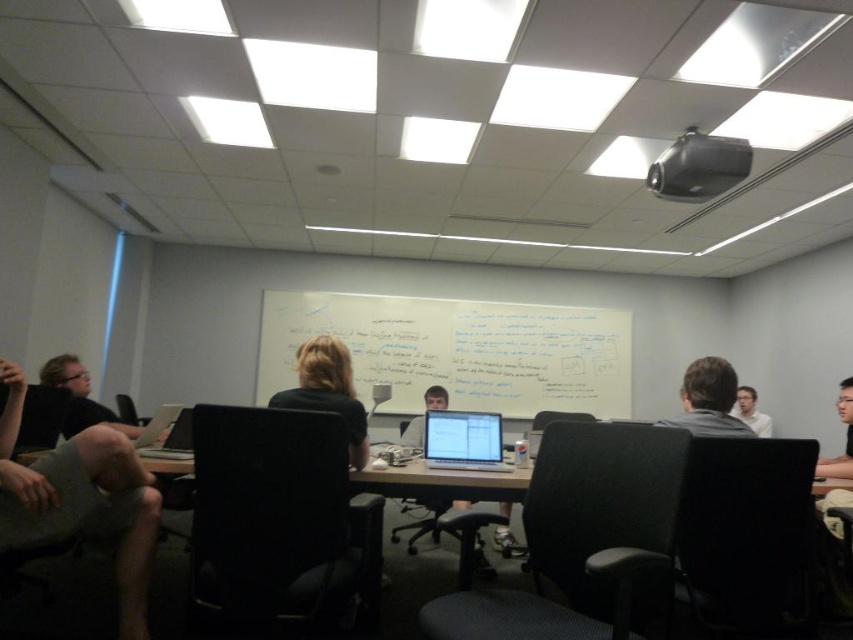
Question: Which object is the closest to the dark gray fabric chair at center?

Choices:
 (A) brown hair at upper right
 (B) smooth skin face at right
 (C) silver metallic laptop at center

Answer: (A)

Question: Which of the following is the closest to the observer?

Choices:
 (A) (744, 419)
 (B) (480, 468)

Answer: (B)

Question: Can you confirm if gray cotton shorts at lower left is positioned above black mesh chair at center?

Choices:
 (A) yes
 (B) no

Answer: (A)

Question: Is black plastic projector at upper center positioned in front of smooth skin face at right?

Choices:
 (A) yes
 (B) no

Answer: (B)

Question: Does black plastic chair at lower right come in front of blonde hair at center?

Choices:
 (A) no
 (B) yes

Answer: (B)

Question: Which of these objects is positioned farthest from the matte black laptop at center?

Choices:
 (A) gray cotton shorts at lower left
 (B) black plastic projector at upper center
 (C) matte black chair at center

Answer: (A)